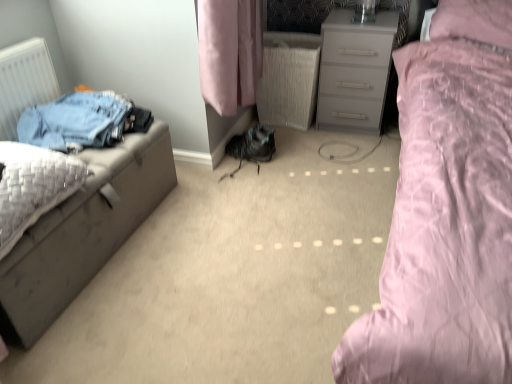
Question: In terms of width, does pink satin bed at right look wider or thinner when compared to matte gray chest of drawers at center?

Choices:
 (A) thin
 (B) wide

Answer: (B)

Question: Based on their sizes in the image, would you say pink satin bed at right is bigger or smaller than matte gray chest of drawers at center?

Choices:
 (A) big
 (B) small

Answer: (A)

Question: Considering the real-world distances, which object is farthest from the matte gray chest of drawers at center?

Choices:
 (A) matte gray nightstand at left
 (B) pink satin bed at right
 (C) white matte radiator at left

Answer: (C)

Question: Based on their relative distances, which object is nearer to the matte gray chest of drawers at center?

Choices:
 (A) white matte radiator at left
 (B) pink satin bed at right
 (C) matte gray nightstand at left

Answer: (B)